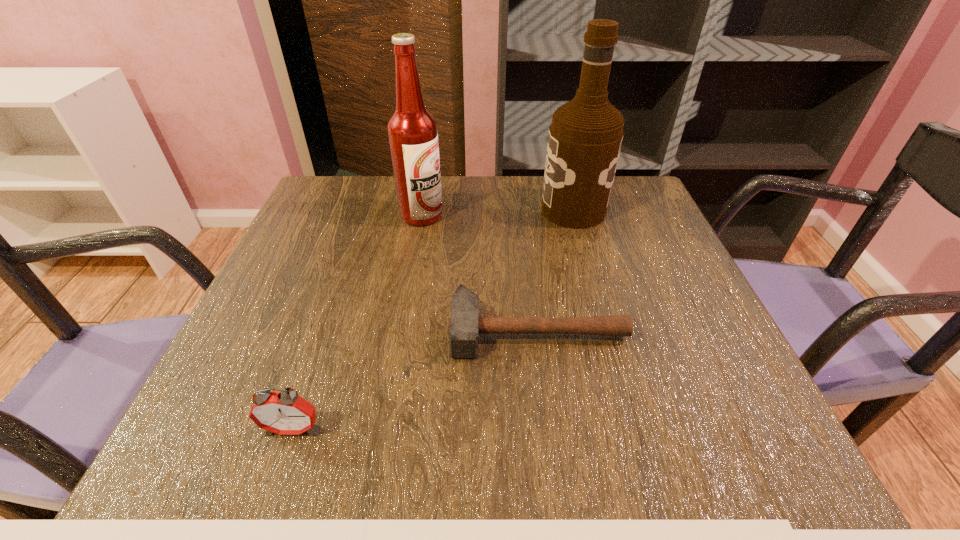
The image size is (960, 540). I want to click on blank region between the third object from right to left and the right alcohol, so click(497, 213).

At what (x,y) coordinates should I click in order to perform the action: click on unoccupied position between the left alcohol and the alarm clock. Please return your answer as a coordinate pair (x, y). This screenshot has width=960, height=540. Looking at the image, I should click on (357, 322).

Find the location of a particular element. This screenshot has height=540, width=960. free point between the hammer and the right alcohol is located at coordinates coord(555,271).

Identify which object is located as the third nearest to the nearest object. Please provide its 2D coordinates. Your answer should be formatted as a tuple, i.e. [(x, y)], where the tuple contains the x and y coordinates of a point satisfying the conditions above.

[(585, 137)]

This screenshot has height=540, width=960. Find the location of `object that is the second closest to the third tallest object`. object that is the second closest to the third tallest object is located at coordinates (412, 131).

Identify the location of vacant space that satisfies the following two spatial constraints: 1. on the label of the right alcohol; 2. on the striking surface of the hammer. (608, 331).

This screenshot has width=960, height=540. I want to click on vacant space that satisfies the following two spatial constraints: 1. on the label of the right alcohol; 2. on the striking surface of the third farthest object, so click(x=608, y=331).

Where is `free space that satisfies the following two spatial constraints: 1. on the label of the right alcohol; 2. on the striking surface of the shortest object`? The height and width of the screenshot is (540, 960). free space that satisfies the following two spatial constraints: 1. on the label of the right alcohol; 2. on the striking surface of the shortest object is located at coordinates (608, 331).